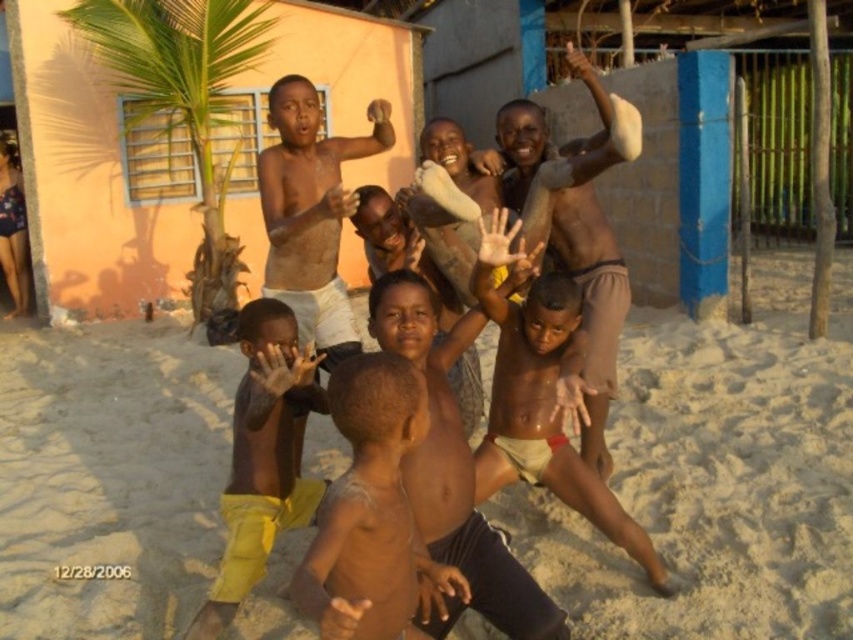
Question: Among these objects, which one is farthest from the camera?

Choices:
 (A) shiny skin boy at center
 (B) brown skin at center

Answer: (A)

Question: Is brown skin man at center closer to the viewer compared to shiny skin boy at center?

Choices:
 (A) yes
 (B) no

Answer: (A)

Question: Can you confirm if sandy beach at center is positioned below yellow fabric pants at lower left?

Choices:
 (A) no
 (B) yes

Answer: (B)

Question: Which point is closer to the camera taking this photo?

Choices:
 (A) (3, 340)
 (B) (305, 276)
 (C) (577, 60)

Answer: (C)

Question: Which of the following is the closest to the observer?

Choices:
 (A) yellow fabric pants at lower left
 (B) brown skin man at center
 (C) matte skin child at center
 (D) shiny skin boy at center

Answer: (C)

Question: Considering the relative positions of sandy beach at center and brown skin at center in the image provided, where is sandy beach at center located with respect to brown skin at center?

Choices:
 (A) right
 (B) left

Answer: (A)